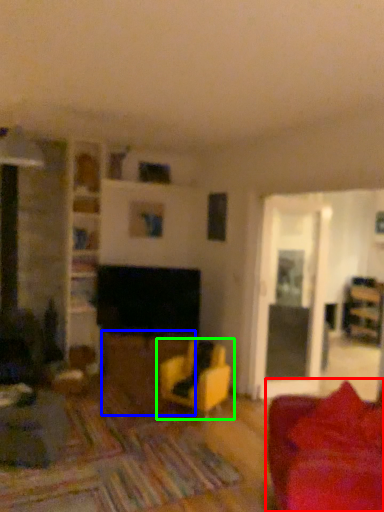
Question: Which is nearer to the studio couch (highlighted by a red box)? table (highlighted by a blue box) or chair (highlighted by a green box).

Choices:
 (A) table
 (B) chair

Answer: (B)